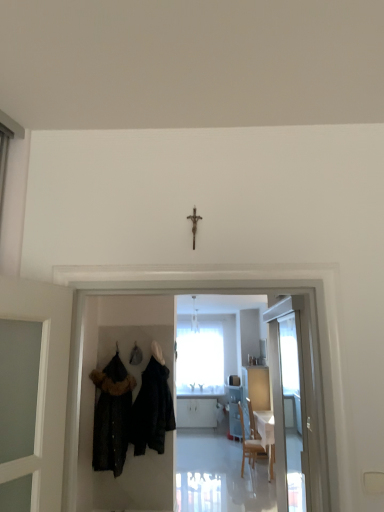
Question: Are metallic crucifix at center and velvet black coat at left, which is counted as the 1th fancy dress, starting from the left, beside each other?

Choices:
 (A) yes
 (B) no

Answer: (B)

Question: Does metallic crucifix at center have a lesser width compared to velvet black coat at left, arranged as the second fancy dress when viewed from the right?

Choices:
 (A) no
 (B) yes

Answer: (B)

Question: Is metallic crucifix at center bigger than velvet black coat at left, which is counted as the 1th fancy dress, starting from the left?

Choices:
 (A) yes
 (B) no

Answer: (B)

Question: Is velvet black coat at left, which is counted as the 1th fancy dress, starting from the left, surrounded by metallic crucifix at center?

Choices:
 (A) no
 (B) yes

Answer: (A)

Question: From a real-world perspective, is metallic crucifix at center positioned under velvet black coat at left, which is counted as the 1th fancy dress, starting from the left, based on gravity?

Choices:
 (A) no
 (B) yes

Answer: (A)

Question: Is metallic crucifix at center positioned with its back to velvet black coat at left, which is counted as the 1th fancy dress, starting from the left?

Choices:
 (A) yes
 (B) no

Answer: (B)

Question: Is velvet black coat at left, arranged as the second fancy dress when viewed from the right, aimed at metallic crucifix at center?

Choices:
 (A) yes
 (B) no

Answer: (A)

Question: Can you confirm if velvet black coat at left, arranged as the second fancy dress when viewed from the right, is positioned to the right of metallic crucifix at center?

Choices:
 (A) yes
 (B) no

Answer: (B)

Question: From a real-world perspective, is velvet black coat at left, which is counted as the 1th fancy dress, starting from the left, on top of metallic crucifix at center?

Choices:
 (A) no
 (B) yes

Answer: (A)

Question: Would you consider velvet black coat at left, arranged as the second fancy dress when viewed from the right, to be distant from metallic crucifix at center?

Choices:
 (A) no
 (B) yes

Answer: (B)

Question: Is velvet black coat at left, which is counted as the 1th fancy dress, starting from the left, thinner than metallic crucifix at center?

Choices:
 (A) no
 (B) yes

Answer: (A)

Question: Is velvet black coat at left, which is counted as the 1th fancy dress, starting from the left, directly adjacent to metallic crucifix at center?

Choices:
 (A) no
 (B) yes

Answer: (A)

Question: Is white glossy door at right positioned in front of velvet black coat at left, which is counted as the 1th fancy dress, starting from the left?

Choices:
 (A) no
 (B) yes

Answer: (B)